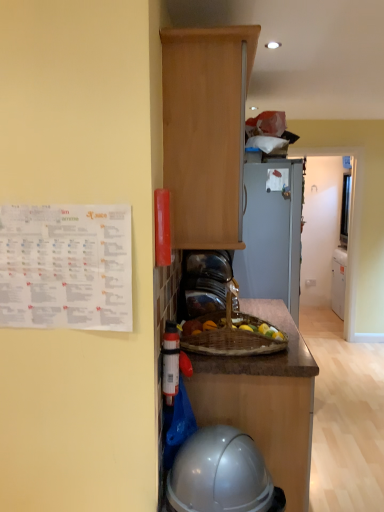
You are a GUI agent. You are given a task and a screenshot of the screen. Output one action in this format:
    pyautogui.click(x=<x>, y=<y>)
    Task: Click on the glossy plastic helmet at lower center
    The height and width of the screenshot is (512, 384).
    Given the screenshot: What is the action you would take?
    pyautogui.click(x=221, y=474)

You are a GUI agent. You are given a task and a screenshot of the screen. Output one action in this format:
    pyautogui.click(x=<x>, y=<y>)
    Task: Click on the wooden cabinet at upper center
    
    Given the screenshot: What is the action you would take?
    pyautogui.click(x=206, y=132)

Image resolution: width=384 pixels, height=512 pixels. I want to click on brown polished wood at center, so click(265, 355).

The height and width of the screenshot is (512, 384). Identify the location of cabinetry located behind the glossy plastic helmet at lower center. (206, 132).

From the image's perspective, which one is positioned lower, glossy plastic helmet at lower center or wooden cabinet at upper center?

From the image's view, glossy plastic helmet at lower center is below.

Can you confirm if glossy plastic helmet at lower center is wider than wooden cabinet at upper center?

Yes.

Is glossy plastic helmet at lower center aimed at wooden cabinet at upper center?

No, glossy plastic helmet at lower center is not aimed at wooden cabinet at upper center.

Based on their sizes in the image, would you say brown polished wood at center is bigger or smaller than glossy plastic helmet at lower center?

brown polished wood at center is smaller than glossy plastic helmet at lower center.

Based on the photo, from a real-world perspective, is brown polished wood at center physically located above or below glossy plastic helmet at lower center?

brown polished wood at center is above glossy plastic helmet at lower center.

Can you confirm if brown polished wood at center is taller than glossy plastic helmet at lower center?

No.

Which object is further away from the camera taking this photo, brown polished wood at center or glossy plastic helmet at lower center?

brown polished wood at center is further away from the camera.

Is brown polished wood at center surrounded by wooden cabinet at upper center?

Definitely not — brown polished wood at center is not inside wooden cabinet at upper center.

Considering the positions of points (197, 40) and (300, 376), is point (197, 40) farther from camera compared to point (300, 376)?

No, it is not.

Considering the sizes of wooden cabinet at upper center and brown polished wood at center in the image, is wooden cabinet at upper center bigger or smaller than brown polished wood at center?

Considering their sizes, wooden cabinet at upper center takes up more space than brown polished wood at center.

Consider the image. From the image's perspective, is wooden cabinet at upper center on brown polished wood at center?

Correct, wooden cabinet at upper center appears higher than brown polished wood at center in the image.

Is glossy plastic helmet at lower center at the left side of brown polished wood at center?

Indeed, glossy plastic helmet at lower center is positioned on the left side of brown polished wood at center.

Identify the location of countertop lying above the glossy plastic helmet at lower center (from the image's perspective). (265, 355).

From the image's perspective, is glossy plastic helmet at lower center beneath brown polished wood at center?

Yes, from the image's perspective, glossy plastic helmet at lower center is below brown polished wood at center.

Based on the photo, from a real-world perspective, who is located higher, glossy plastic helmet at lower center or brown polished wood at center?

brown polished wood at center.

Can you confirm if brown polished wood at center is wider than wooden cabinet at upper center?

Indeed, brown polished wood at center has a greater width compared to wooden cabinet at upper center.

From the image's perspective, which one is positioned higher, brown polished wood at center or wooden cabinet at upper center?

From the image's view, wooden cabinet at upper center is above.

Is wooden cabinet at upper center aimed at glossy plastic helmet at lower center?

No.

Which object is further away from the camera, wooden cabinet at upper center or glossy plastic helmet at lower center?

wooden cabinet at upper center.

Can you confirm if wooden cabinet at upper center is taller than glossy plastic helmet at lower center?

Yes.

In order to click on helmet to the right of wooden cabinet at upper center in this screenshot , I will do `click(221, 474)`.

At what (x,y) coordinates should I click in order to perform the action: click on helmet located below the brown polished wood at center (from the image's perspective). Please return your answer as a coordinate pair (x, y). The width and height of the screenshot is (384, 512). Looking at the image, I should click on (221, 474).

In the scene shown: When comparing their distances from wooden cabinet at upper center, does brown polished wood at center or glossy plastic helmet at lower center seem closer?

The object closer to wooden cabinet at upper center is brown polished wood at center.

Looking at the image, which one is located further to brown polished wood at center, glossy plastic helmet at lower center or wooden cabinet at upper center?

wooden cabinet at upper center.

Estimate the real-world distances between objects in this image. Which object is closer to wooden cabinet at upper center, glossy plastic helmet at lower center or brown polished wood at center?

brown polished wood at center.

Estimate the real-world distances between objects in this image. Which object is closer to glossy plastic helmet at lower center, wooden cabinet at upper center or brown polished wood at center?

The object closer to glossy plastic helmet at lower center is brown polished wood at center.

From the image, which object appears to be farther from brown polished wood at center, wooden cabinet at upper center or glossy plastic helmet at lower center?

wooden cabinet at upper center is positioned further to the anchor brown polished wood at center.

Which object lies nearer to the anchor point glossy plastic helmet at lower center, brown polished wood at center or wooden cabinet at upper center?

Based on the image, brown polished wood at center appears to be nearer to glossy plastic helmet at lower center.

Identify the location of countertop that lies between wooden cabinet at upper center and glossy plastic helmet at lower center from top to bottom. (265, 355).